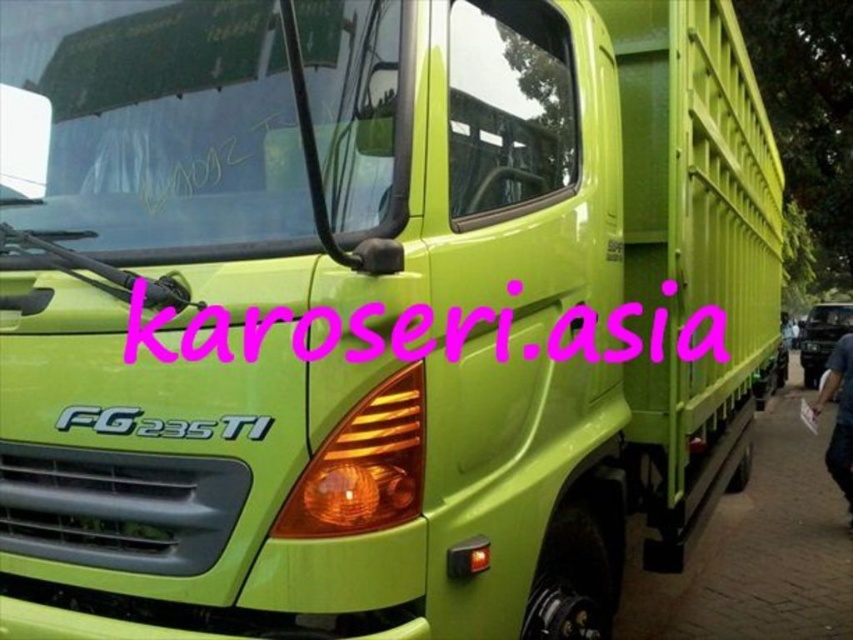
How distant is pink text at center from green matte license plate at center?

The distance of pink text at center from green matte license plate at center is 50.87 feet.

Does pink text at center have a greater height compared to green matte license plate at center?

Yes, pink text at center is taller than green matte license plate at center.

You are a GUI agent. You are given a task and a screenshot of the screen. Output one action in this format:
    pyautogui.click(x=<x>, y=<y>)
    Task: Click on the pink text at center
    The height and width of the screenshot is (640, 853).
    Given the screenshot: What is the action you would take?
    pyautogui.click(x=606, y=332)